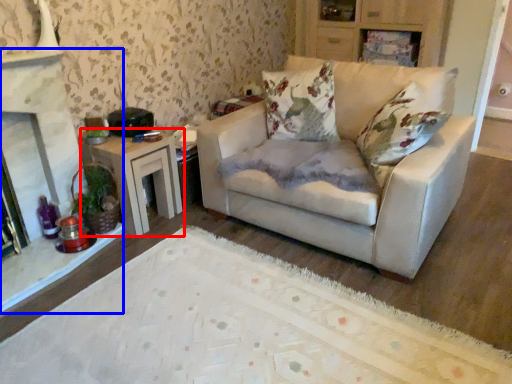
Question: Which object appears closest to the camera in this image, table (highlighted by a red box) or fireplace (highlighted by a blue box)?

Choices:
 (A) table
 (B) fireplace

Answer: (B)